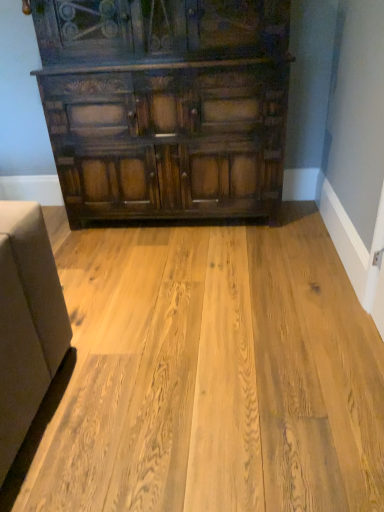
From the picture: Measure the distance between natural wood floor at center and camera.

They are 3.72 feet apart.

Measure the distance between point (288, 254) and camera.

Point (288, 254) and camera are 7.57 feet apart from each other.

What do you see at coordinates (208, 376) in the screenshot? I see `natural wood floor at center` at bounding box center [208, 376].

Locate an element on the screen. natural wood floor at center is located at coordinates [208, 376].

Describe the element at coordinates (165, 105) in the screenshot. Image resolution: width=384 pixels, height=512 pixels. I see `dark wood cabinet at upper center` at that location.

You are a GUI agent. You are given a task and a screenshot of the screen. Output one action in this format:
    pyautogui.click(x=<x>, y=<y>)
    Task: Click on the dark wood cabinet at upper center
    This screenshot has height=512, width=384.
    Given the screenshot: What is the action you would take?
    pyautogui.click(x=165, y=105)

In order to click on natural wood floor at center in this screenshot , I will do `click(208, 376)`.

Between natural wood floor at center and dark wood cabinet at upper center, which one appears on the left side from the viewer's perspective?

natural wood floor at center is more to the left.

Considering the positions of objects natural wood floor at center and dark wood cabinet at upper center in the image provided, who is in front, natural wood floor at center or dark wood cabinet at upper center?

natural wood floor at center is more forward.

Considering the positions of points (341, 432) and (277, 189), is point (341, 432) farther from camera compared to point (277, 189)?

No.

From the image's perspective, which is below, natural wood floor at center or dark wood cabinet at upper center?

natural wood floor at center is shown below in the image.

From a real-world perspective, relative to dark wood cabinet at upper center, is natural wood floor at center vertically above or below?

natural wood floor at center is below dark wood cabinet at upper center.

Considering the sizes of objects natural wood floor at center and dark wood cabinet at upper center in the image provided, who is wider, natural wood floor at center or dark wood cabinet at upper center?

Wider between the two is natural wood floor at center.

Based on the photo, between natural wood floor at center and dark wood cabinet at upper center, which one has less height?

natural wood floor at center is shorter.

Considering the sizes of objects natural wood floor at center and dark wood cabinet at upper center in the image provided, who is bigger, natural wood floor at center or dark wood cabinet at upper center?

dark wood cabinet at upper center.

Do you think natural wood floor at center is within dark wood cabinet at upper center, or outside of it?

natural wood floor at center is not inside dark wood cabinet at upper center, it's outside.

Is natural wood floor at center next to dark wood cabinet at upper center?

No, natural wood floor at center is not making contact with dark wood cabinet at upper center.

Is natural wood floor at center oriented towards dark wood cabinet at upper center?

No, natural wood floor at center is not turned towards dark wood cabinet at upper center.

Can you tell me how much natural wood floor at center and dark wood cabinet at upper center differ in facing direction?

88 degrees.

Where is `chest of drawers located on the right of natural wood floor at center`? This screenshot has height=512, width=384. chest of drawers located on the right of natural wood floor at center is located at coordinates (165, 105).

Considering the positions of objects dark wood cabinet at upper center and natural wood floor at center in the image provided, who is more to the left, dark wood cabinet at upper center or natural wood floor at center?

Positioned to the left is natural wood floor at center.

Considering their positions, is dark wood cabinet at upper center located in front of or behind natural wood floor at center?

In the image, dark wood cabinet at upper center appears behind natural wood floor at center.

Does point (111, 69) come in front of point (23, 496)?

No, it is behind (23, 496).

From the image's perspective, is dark wood cabinet at upper center on natural wood floor at center?

Yes, from the image's perspective, dark wood cabinet at upper center is over natural wood floor at center.

From a real-world perspective, is dark wood cabinet at upper center physically located above or below natural wood floor at center?

In terms of real-world spatial position, dark wood cabinet at upper center is above natural wood floor at center.

Looking at their sizes, would you say dark wood cabinet at upper center is wider or thinner than natural wood floor at center?

Considering their sizes, dark wood cabinet at upper center looks slimmer than natural wood floor at center.

Who is shorter, dark wood cabinet at upper center or natural wood floor at center?

With less height is natural wood floor at center.

Which of these two, dark wood cabinet at upper center or natural wood floor at center, is bigger?

dark wood cabinet at upper center.

Is dark wood cabinet at upper center inside the boundaries of natural wood floor at center, or outside?

dark wood cabinet at upper center is outside natural wood floor at center.

Is dark wood cabinet at upper center in contact with natural wood floor at center?

No, dark wood cabinet at upper center is not beside natural wood floor at center.

Is dark wood cabinet at upper center facing towards natural wood floor at center?

Yes, dark wood cabinet at upper center is aimed at natural wood floor at center.

Identify the location of plywood below the dark wood cabinet at upper center (from a real-world perspective). The height and width of the screenshot is (512, 384). (208, 376).

Identify the location of plywood on the left of dark wood cabinet at upper center. (208, 376).

Image resolution: width=384 pixels, height=512 pixels. In order to click on plywood below the dark wood cabinet at upper center (from the image's perspective) in this screenshot , I will do `click(208, 376)`.